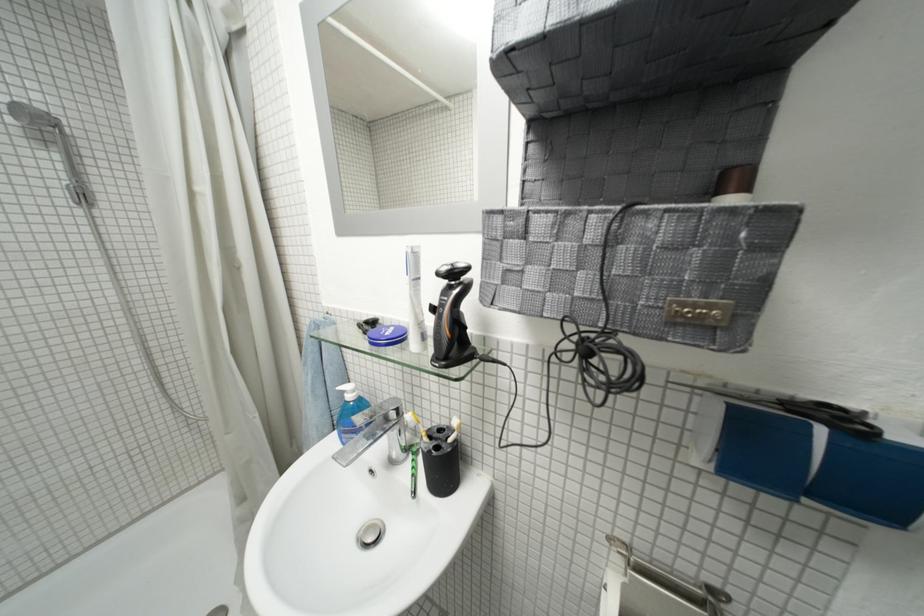
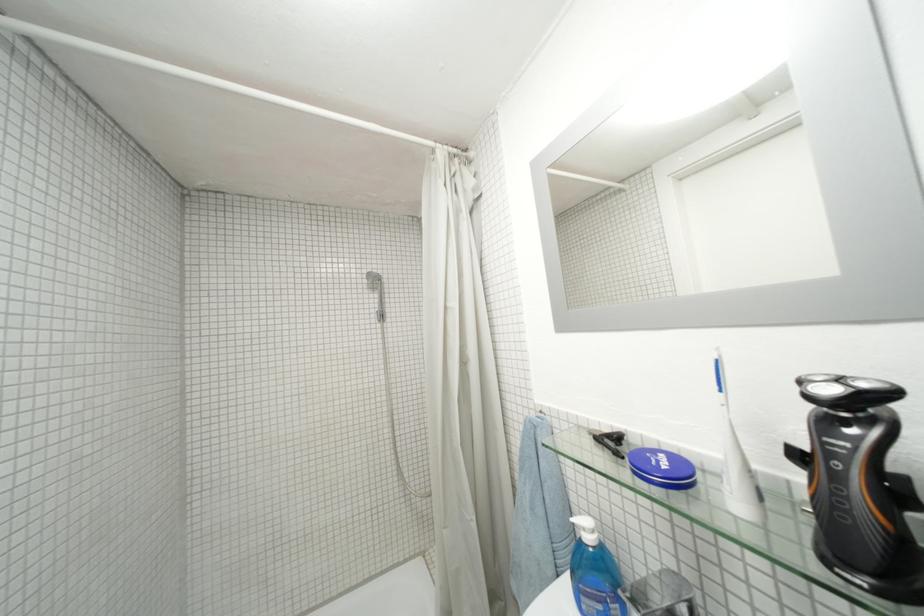
Locate, in the second image, the point that corresponds to point 359,399 in the first image.

(598, 541)